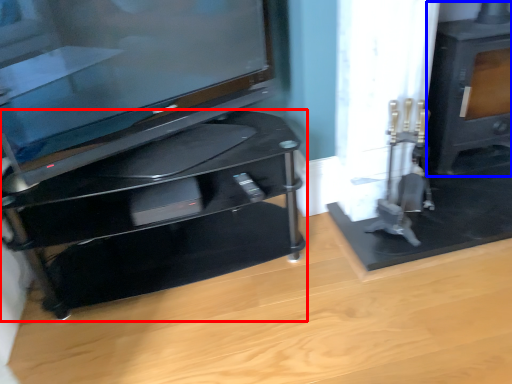
Question: Which object appears closest to the camera in this image, furniture (highlighted by a red box) or stove (highlighted by a blue box)?

Choices:
 (A) furniture
 (B) stove

Answer: (A)